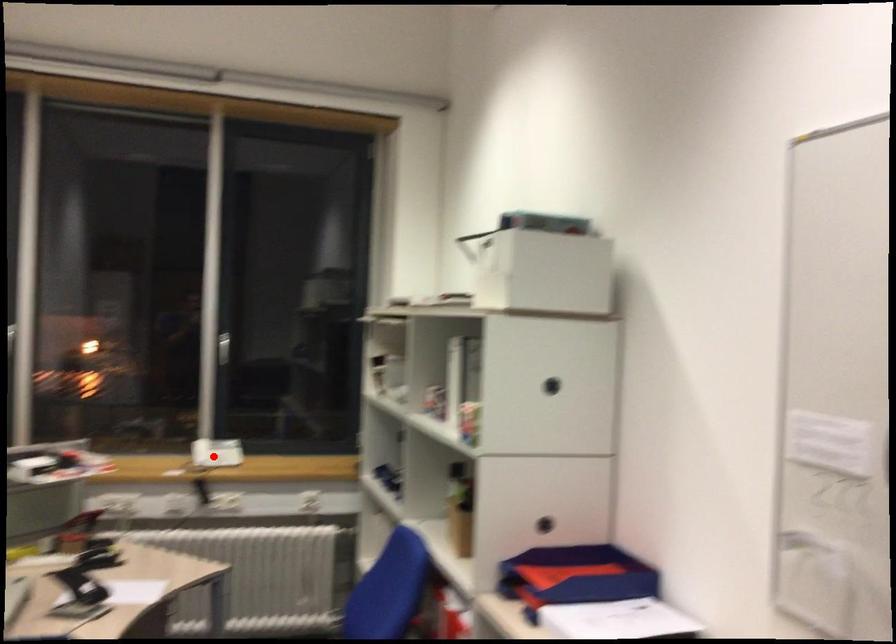
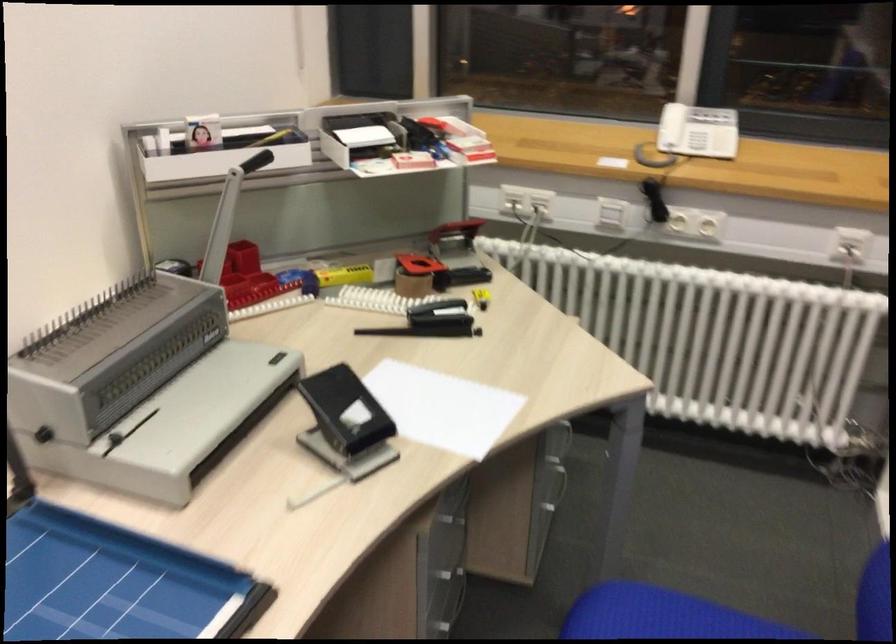
Find the pixel in the second image that matches the highlighted location in the first image.

(686, 144)